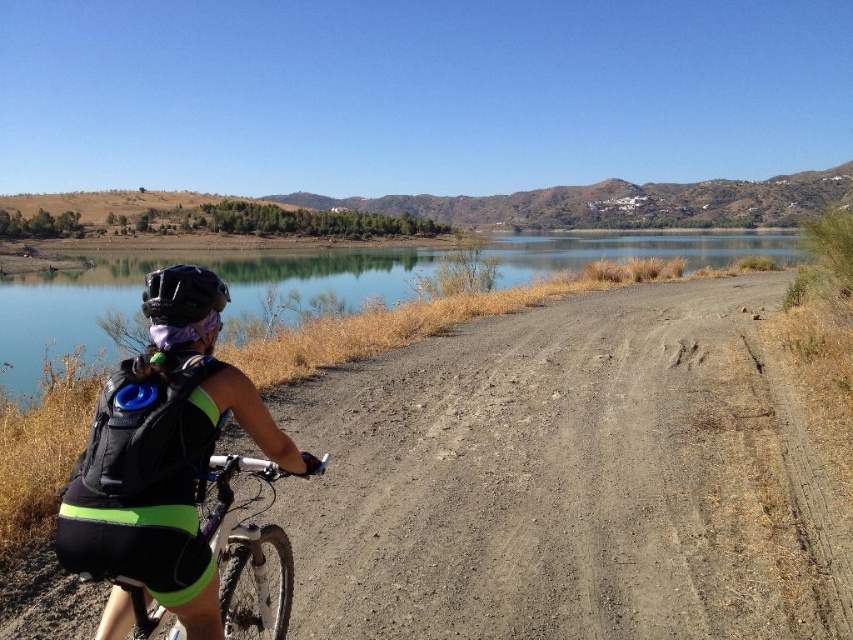
You are a photographer standing at the center of the scene. You want to take a photo that includes both the point at coordinates point (396, 259) and point (202, 284). Which point should you focus on to ensure both are in sharp focus?

To ensure both points are in sharp focus, focus on point (202, 284) since it is closer to the camera and has a smaller depth of field requirement. However, since point (396, 259) is further away, focusing on the closer point may not guarantee both are sharp. Alternatively, using a smaller aperture or focusing at the hyperfocal distance might be better, but based on the given information, focusing on the closer point is the initial step.